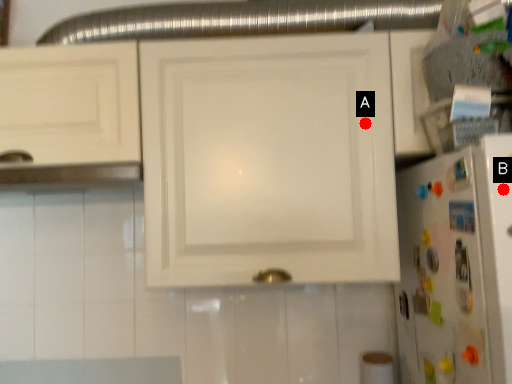
Question: Two points are circled on the image, labeled by A and B beside each circle. Which point appears closest to the camera in this image?

Choices:
 (A) A is closer
 (B) B is closer

Answer: (B)